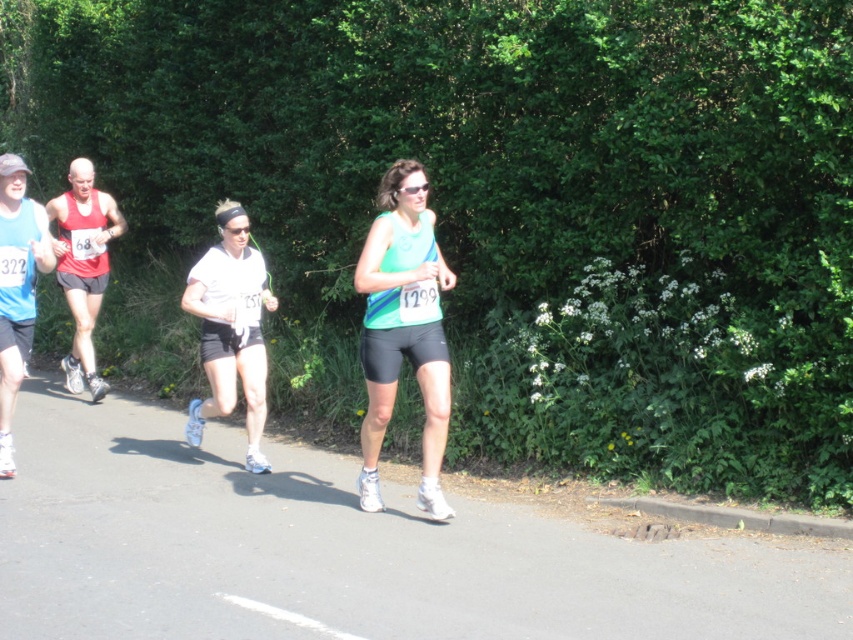
You are a photographer positioned at the starting line of the race. You want to capture a photo that includes both the white matte shorts at center and the matte blue tank top at left. The camera can focus on objects within a 5 feet range. Will both objects be in focus?

The white matte shorts at center is 4.67 feet away from the matte blue tank top at left. Since the distance between them is within the 5 feet range, both objects will be in focus.

You are a photographer trying to capture the runner in the center. Based on the image, which object is positioned to the right of the other between the white matte shorts at center and the matte blue tank top at left?

The white matte shorts at center are positioned to the right of the matte blue tank top at left according to the description.

You are a photographer positioned at the starting line of the race. You want to take a photo that focuses on the matte green tank top at center and the white matte shorts at center. Which of these items will appear larger in your photo?

The matte green tank top at center will appear larger in the photo because it is closer to the viewer than the white matte shorts at center.